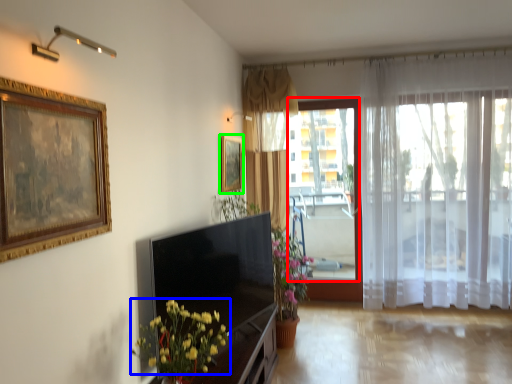
Question: Based on their relative distances, which object is nearer to window screen (highlighted by a red box)? Choose from flower (highlighted by a blue box) and picture frame (highlighted by a green box).

Choices:
 (A) flower
 (B) picture frame

Answer: (B)